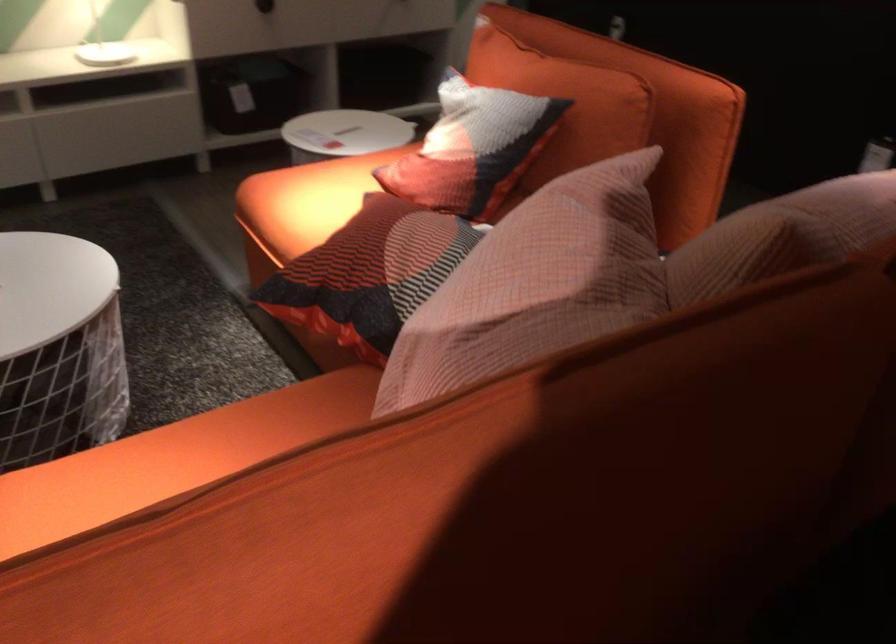
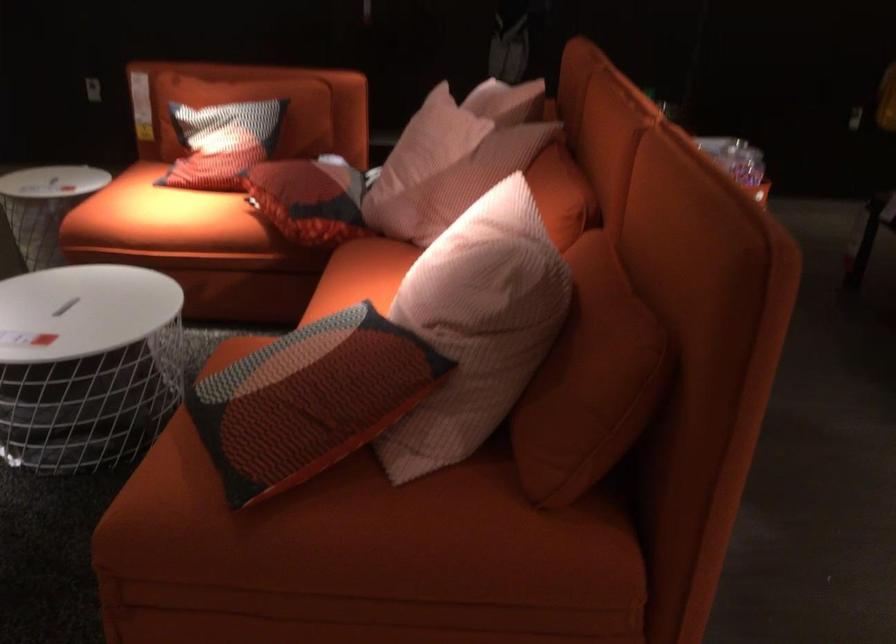
Locate, in the second image, the point that corresponds to the point at 300,216 in the first image.

(160, 216)